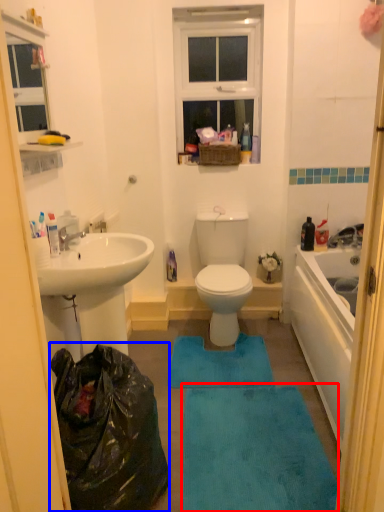
Question: Among these objects, which one is nearest to the camera, bath mat (highlighted by a red box) or garbage (highlighted by a blue box)?

Choices:
 (A) bath mat
 (B) garbage

Answer: (B)